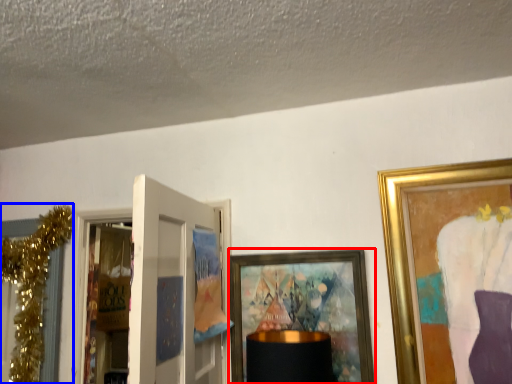
Question: Which object is further to the camera taking this photo, picture frame (highlighted by a red box) or christmas decoration (highlighted by a blue box)?

Choices:
 (A) picture frame
 (B) christmas decoration

Answer: (B)